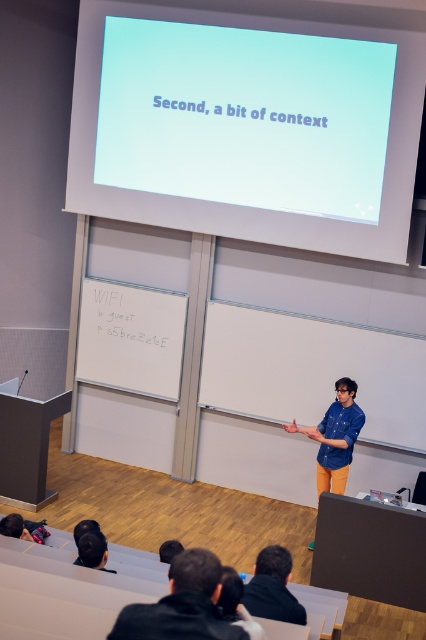
Question: Which object appears closest to the camera in this image?

Choices:
 (A) black fabric jacket at lower center
 (B) white glossy projection screen at upper center
 (C) denim jacket at lower center

Answer: (C)

Question: Which of the following is the farthest from the observer?

Choices:
 (A) denim jacket at lower center
 (B) black fabric jacket at lower center
 (C) white glossy projection screen at upper center
 (D) denim shirt at center

Answer: (C)

Question: Which object is farther from the camera taking this photo?

Choices:
 (A) white glossy projection screen at upper center
 (B) black fabric jacket at lower center
 (C) denim jacket at lower center
 (D) denim shirt at center

Answer: (A)

Question: Can you confirm if white glossy projection screen at upper center is positioned below black fabric jacket at lower center?

Choices:
 (A) yes
 (B) no

Answer: (B)

Question: Does white glossy projection screen at upper center have a larger size compared to black fabric jacket at lower center?

Choices:
 (A) yes
 (B) no

Answer: (A)

Question: Where is white glossy projection screen at upper center located in relation to black fabric jacket at lower center in the image?

Choices:
 (A) above
 (B) below

Answer: (A)